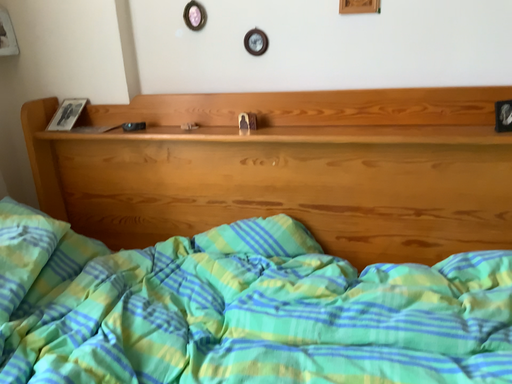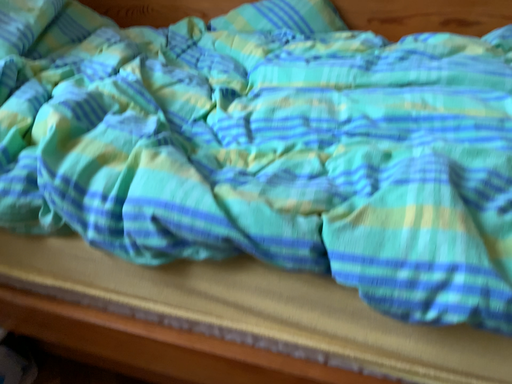
Question: Which way did the camera rotate in the video?

Choices:
 (A) rotated downward
 (B) rotated upward

Answer: (A)